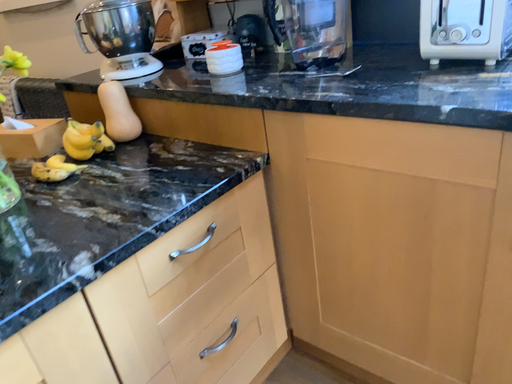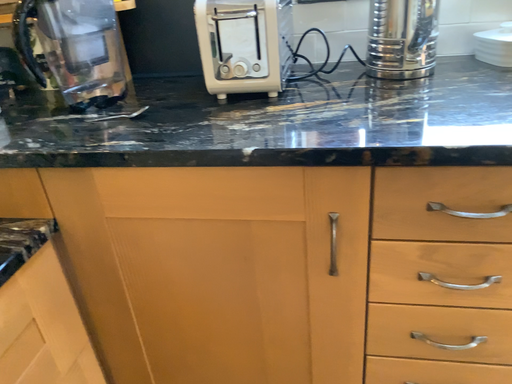
Question: How did the camera likely rotate when shooting the video?

Choices:
 (A) rotated left
 (B) rotated right

Answer: (B)